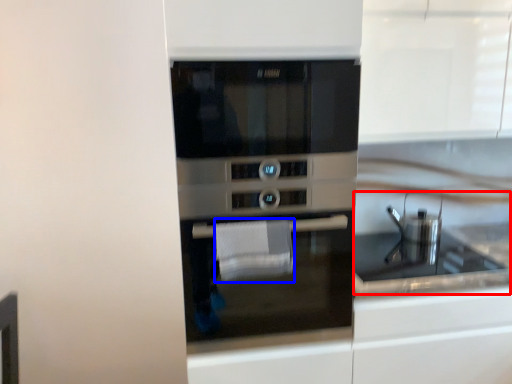
Question: Which point is further to the camera, sink (highlighted by a red box) or hand towel (highlighted by a blue box)?

Choices:
 (A) sink
 (B) hand towel

Answer: (A)